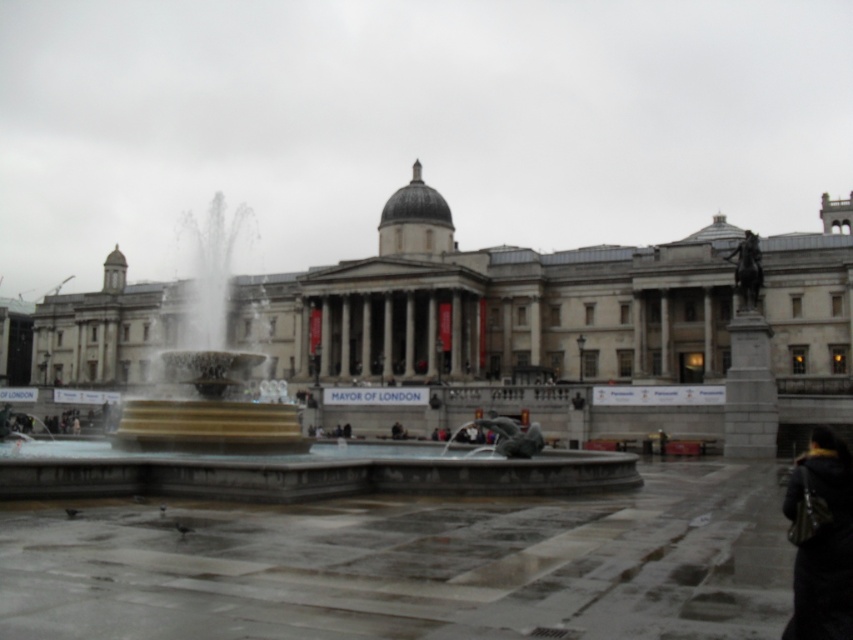
Question: Observing the image, what is the correct spatial positioning of stone fountain at center in reference to silver metallic fountain at center?

Choices:
 (A) below
 (B) above

Answer: (B)

Question: Is stone fountain at center positioned behind gray stone statue at right?

Choices:
 (A) no
 (B) yes

Answer: (A)

Question: Which point is closer to the camera taking this photo?

Choices:
 (A) (735, 449)
 (B) (253, 404)

Answer: (B)

Question: Does black leather jacket at lower right come behind gray stone statue at right?

Choices:
 (A) yes
 (B) no

Answer: (B)

Question: Among these objects, which one is farthest from the camera?

Choices:
 (A) stone fountain at center
 (B) silver metallic fountain at center
 (C) gray stone statue at right
 (D) black leather jacket at lower right

Answer: (C)

Question: Which is farther from the stone fountain at center?

Choices:
 (A) gray stone statue at right
 (B) black leather jacket at lower right
 (C) silver metallic fountain at center

Answer: (B)